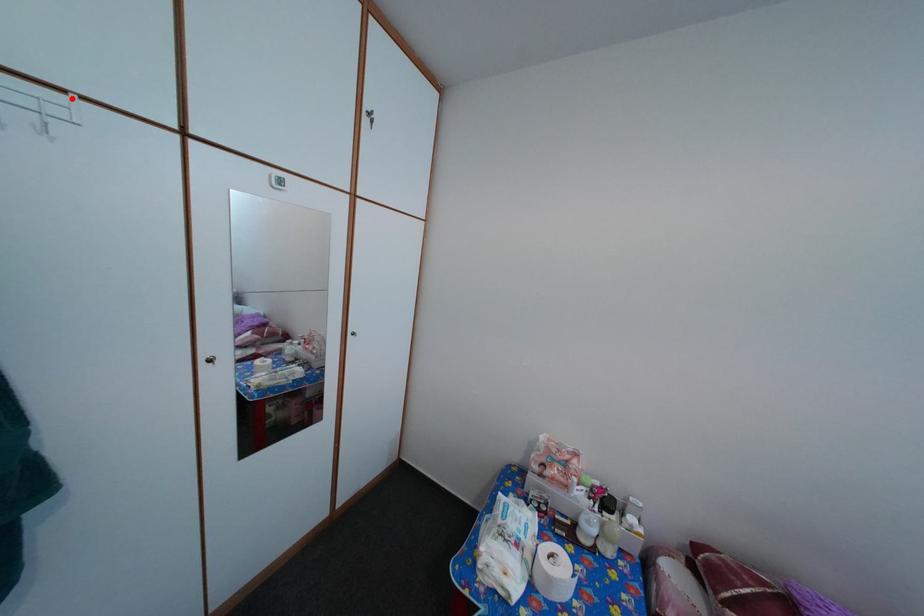
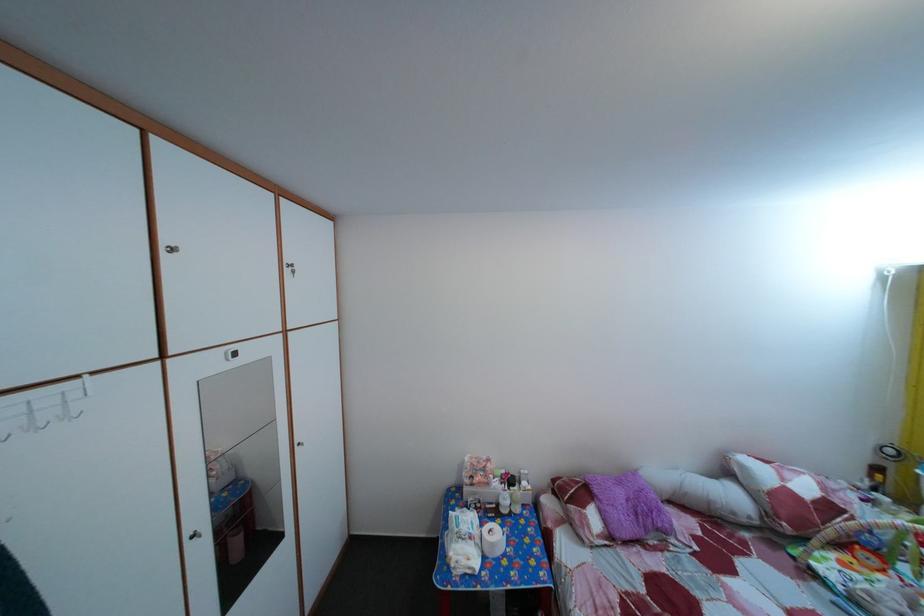
Where in the second image is the point corresponding to the highlighted location from the first image?

(86, 384)